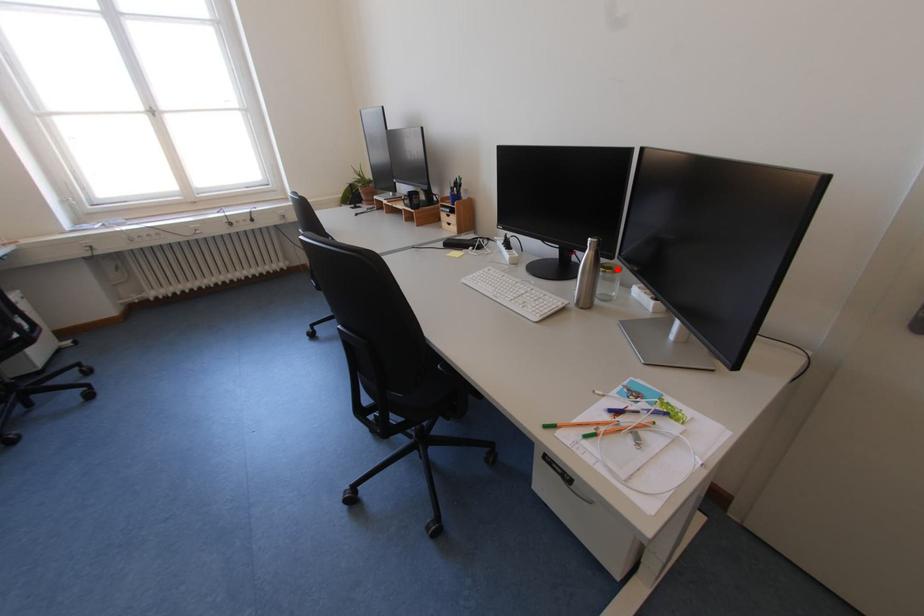
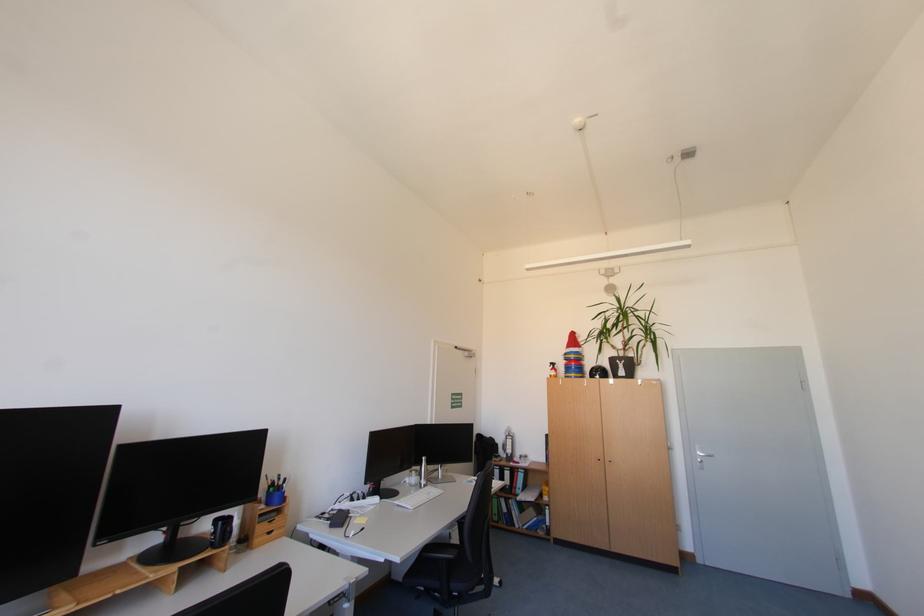
Question: I am providing you with two images of the same scene from different viewpoints. A red point is marked on the first image. Can you still see the location of the red point in image 2?

Choices:
 (A) Yes
 (B) No

Answer: (B)